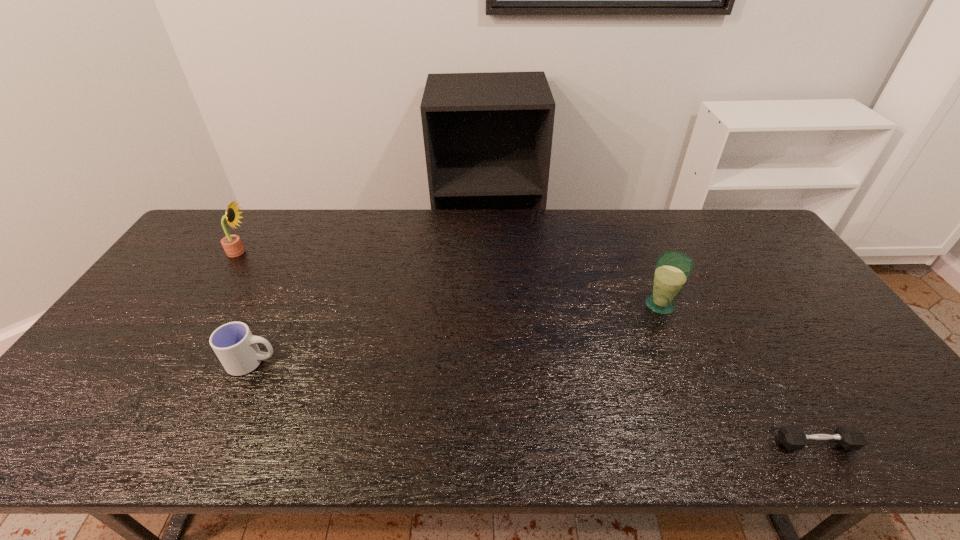
The image size is (960, 540). What are the coordinates of `the leftmost object` in the screenshot? It's located at (233, 247).

At what (x,y) coordinates should I click in order to perform the action: click on sunflower. Please return your answer as a coordinate pair (x, y). Looking at the image, I should click on (233, 247).

You are a GUI agent. You are given a task and a screenshot of the screen. Output one action in this format:
    pyautogui.click(x=<x>, y=<y>)
    Task: Click on the second tallest object
    
    Given the screenshot: What is the action you would take?
    pyautogui.click(x=672, y=270)

The height and width of the screenshot is (540, 960). Find the location of `glass`. glass is located at coordinates (672, 270).

This screenshot has width=960, height=540. What are the coordinates of `cup` in the screenshot? It's located at (233, 343).

Where is `the second shortest object`? The width and height of the screenshot is (960, 540). the second shortest object is located at coordinates (233, 343).

The width and height of the screenshot is (960, 540). What are the coordinates of `the rightmost object` in the screenshot? It's located at (791, 437).

Locate an element on the screen. This screenshot has width=960, height=540. the nearest object is located at coordinates click(x=791, y=437).

Identify the location of vacant space located on the face of the farthest object. This screenshot has height=540, width=960. (282, 252).

Identify the location of free space located 0.220m on the back of the glass. (636, 247).